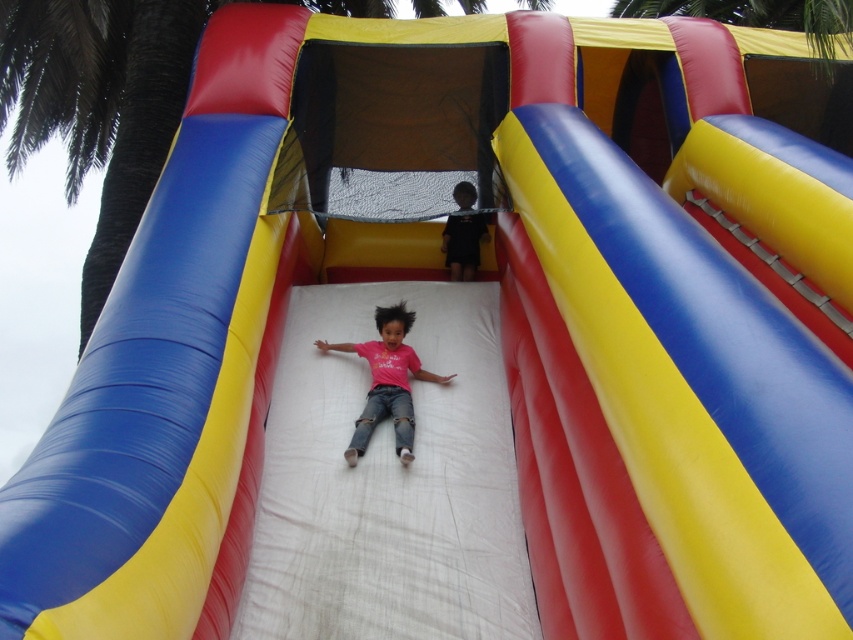
Question: Which point is closer to the camera taking this photo?

Choices:
 (A) (453, 276)
 (B) (396, 394)

Answer: (B)

Question: Which object is closer to the camera taking this photo?

Choices:
 (A) pink matte shirt at center
 (B) dark blue fabric boy at upper center

Answer: (A)

Question: Can you confirm if pink matte shirt at center is positioned above dark blue fabric boy at upper center?

Choices:
 (A) no
 (B) yes

Answer: (A)

Question: Where is pink matte shirt at center located in relation to dark blue fabric boy at upper center in the image?

Choices:
 (A) right
 (B) left

Answer: (B)

Question: From the image, what is the correct spatial relationship of pink matte shirt at center in relation to dark blue fabric boy at upper center?

Choices:
 (A) above
 (B) below

Answer: (B)

Question: Which object appears closest to the camera in this image?

Choices:
 (A) dark blue fabric boy at upper center
 (B) pink matte shirt at center

Answer: (B)